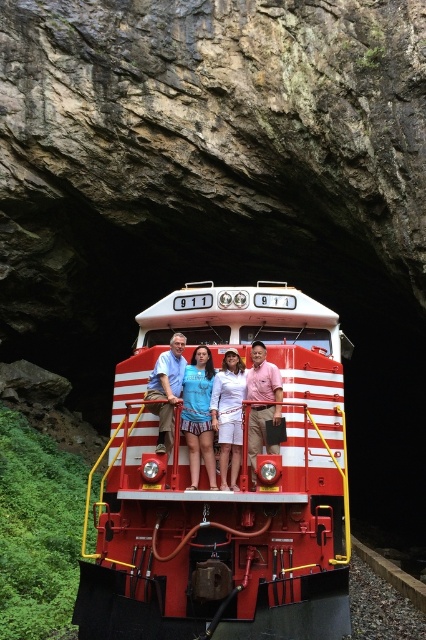
Question: Does matte blue shorts at center appear on the left side of matte white shirt at center?

Choices:
 (A) yes
 (B) no

Answer: (B)

Question: Is shiny red train at center further to the viewer compared to pink cotton shirt at center?

Choices:
 (A) no
 (B) yes

Answer: (B)

Question: Which of the following is the farthest from the observer?

Choices:
 (A) matte white shirt at center
 (B) matte blue shorts at center
 (C) white matte shorts at center

Answer: (A)

Question: Among these objects, which one is farthest from the camera?

Choices:
 (A) shiny red train at center
 (B) matte blue shorts at center
 (C) matte white shirt at center

Answer: (C)

Question: Which object is positioned closest to the shiny red train at center?

Choices:
 (A) matte white shirt at center
 (B) white matte shorts at center
 (C) pink cotton shirt at center

Answer: (A)

Question: Is matte blue shorts at center closer to the viewer compared to pink cotton shirt at center?

Choices:
 (A) no
 (B) yes

Answer: (A)